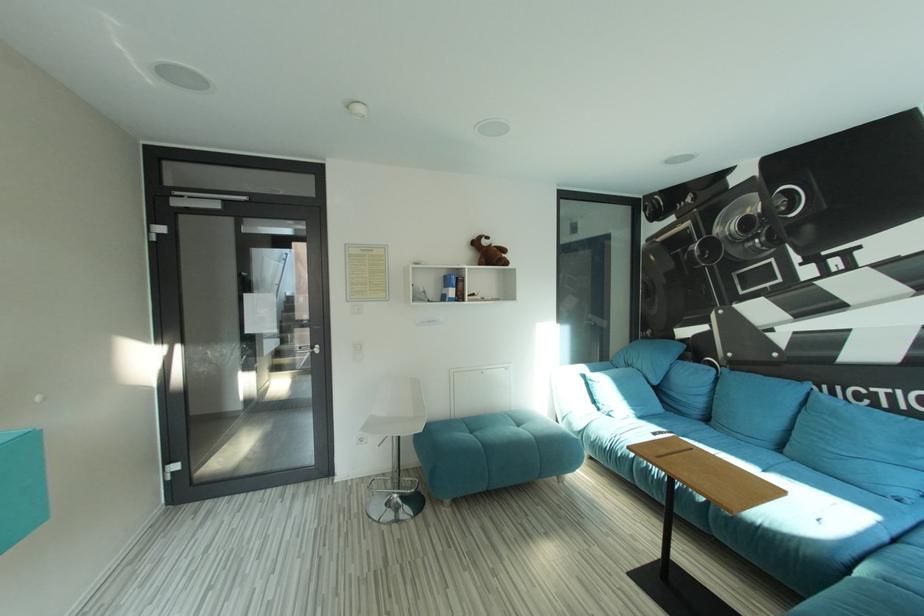
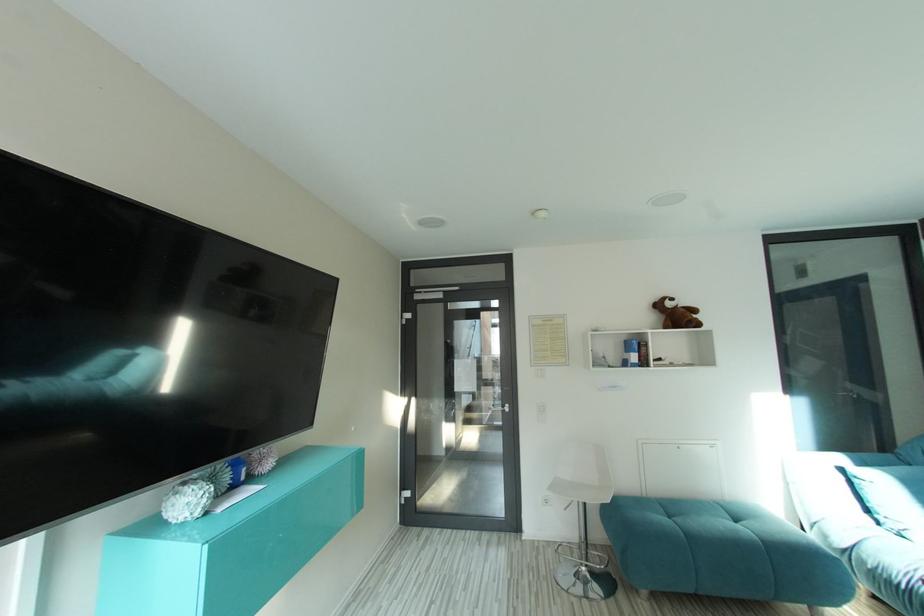
Question: The images are taken continuously from a first-person perspective. In which direction is your viewpoint rotating?

Choices:
 (A) Left
 (B) Right
 (C) Up
 (D) Down

Answer: (A)